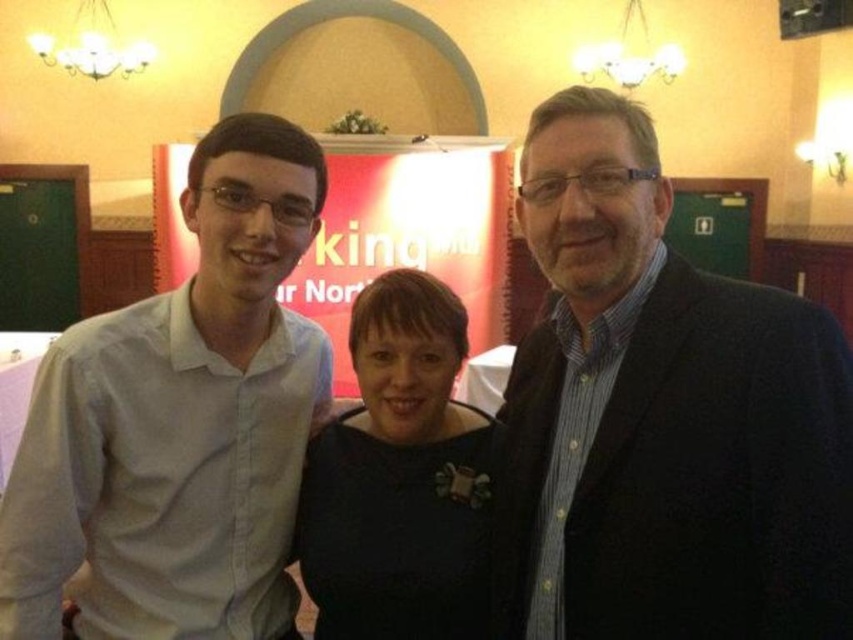
You are at a formal event and see the white shirt at center and the black matte dress at center. Which one is positioned to the left?

The white shirt at center is positioned to the left of the black matte dress at center.

Based on the scene description, where is the dark blue suit at center located in the image?

The dark blue suit at center is located at point 0.652 on the x axis and 0.780 on the y axis.

You are organizing a photo shoot and need to ensure that all outfits are visible in the frame. Given that the white shirt at center and the black matte dress at center are both in the center of the image, which one might require more space in the frame to be fully captured?

The white shirt at center is bigger than the black matte dress at center, so it would require more space in the frame to be fully captured.